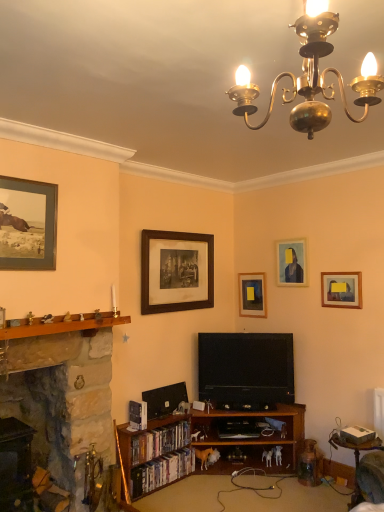
I want to click on free space in front of black glossy bookshelf at lower left, placed as the 2th book when sorted from top to bottom, so 162,500.